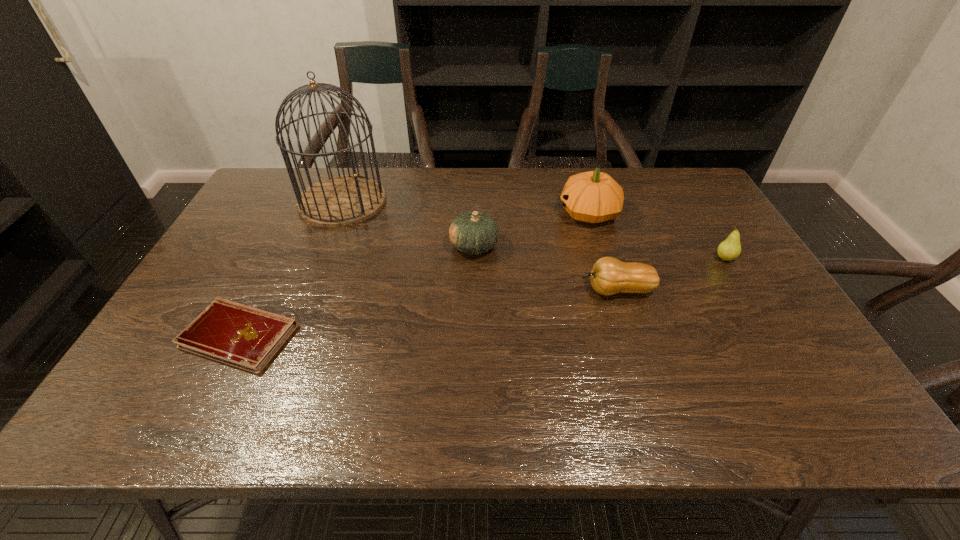
At what (x,y) coordinates should I click in order to perform the action: click on free space located 0.350m on the back of the pear. Please return your answer as a coordinate pair (x, y). The height and width of the screenshot is (540, 960). Looking at the image, I should click on (682, 186).

This screenshot has height=540, width=960. Identify the location of vacant space located on the front of the leftmost gourd. (473, 304).

Find the location of `vacant area situated on the stem side of the nearest gourd`. vacant area situated on the stem side of the nearest gourd is located at coordinates (454, 290).

I want to click on vacant position located on the stem side of the nearest gourd, so click(439, 290).

This screenshot has width=960, height=540. In order to click on free space located on the stem side of the nearest gourd in this screenshot , I will do `click(522, 290)`.

In order to click on vacant space situated on the right of the shortest object in this screenshot , I will do `click(462, 336)`.

Find the location of a particular element. Image resolution: width=960 pixels, height=540 pixels. birdcage that is at the far edge is located at coordinates (340, 201).

The height and width of the screenshot is (540, 960). I want to click on gourd that is positioned at the far edge, so pos(592,197).

Where is `object located at the left edge`? The width and height of the screenshot is (960, 540). object located at the left edge is located at coordinates (238, 335).

The height and width of the screenshot is (540, 960). I want to click on object that is at the right edge, so click(x=730, y=249).